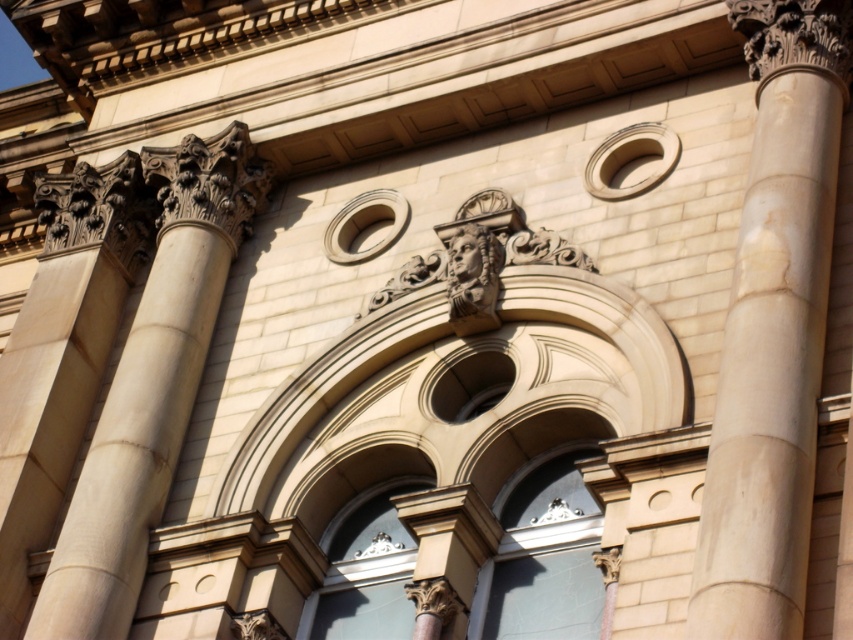
You are an architect examining the classical building facade. You need to determine which object is wider between the beige stone column at left and the carved stone face at center. Based on the scene, which one is wider?

The beige stone column at left is wider than the carved stone face at center because the beige stone column at left has a greater width as stated in the description.

You are an architect examining the classical building. You notice two columns, the beige marble column at center and the beige stone column at left. Which one has a larger size?

The beige marble column at center is bigger than the beige stone column at left, so the beige marble column at center has a larger size.